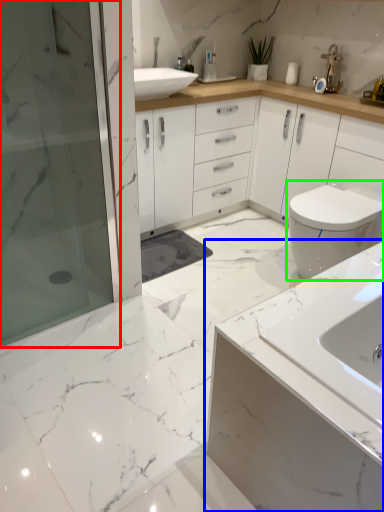
Question: Based on their relative distances, which object is farther from shower door (highlighted by a red box)? Choose from bathroom cabinet (highlighted by a blue box) and toilet (highlighted by a green box).

Choices:
 (A) bathroom cabinet
 (B) toilet

Answer: (A)